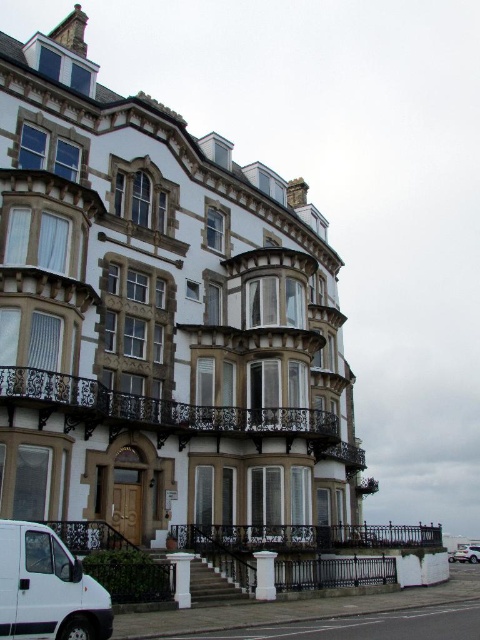
Question: Can you confirm if white matte van at lower left is smaller than white matte suv at lower right?

Choices:
 (A) no
 (B) yes

Answer: (B)

Question: Which object is closer to the camera taking this photo?

Choices:
 (A) white matte suv at lower right
 (B) dark brown wrought iron balcony at center

Answer: (B)

Question: Does white matte van at lower left have a lesser width compared to white matte suv at lower right?

Choices:
 (A) no
 (B) yes

Answer: (B)

Question: Which of the following is the closest to the observer?

Choices:
 (A) white matte van at lower left
 (B) white matte suv at lower right

Answer: (A)

Question: Is white matte van at lower left smaller than white matte suv at lower right?

Choices:
 (A) yes
 (B) no

Answer: (A)

Question: Which of the following is the farthest from the observer?

Choices:
 (A) (104, 636)
 (B) (466, 561)
 (C) (67, 403)

Answer: (B)